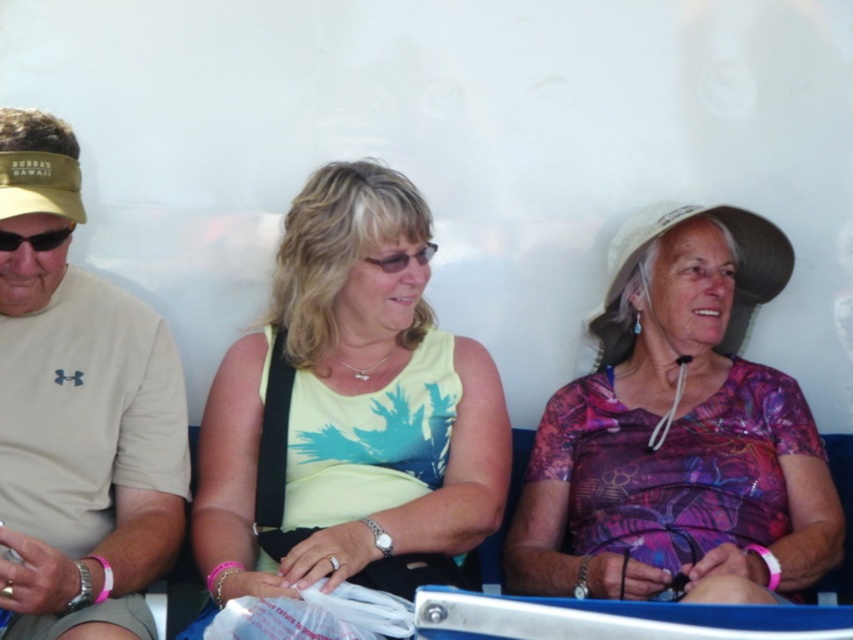
You are standing at the entrance of the fair and want to take a photo of both the purple printed dress at center and the black plastic sunglasses at left. Given that your camera can focus on objects within a 5 feet range, will you be able to capture both in one shot?

The distance between the purple printed dress at center and the black plastic sunglasses at left is 4.28 feet, which is within the 5 feet range of the camera. Therefore, you can capture both in one shot.

You are a fashion designer observing the attendees at a festival. You notice the yellow fabric tank top at center and the matte black glasses at center. Which of these two items appears bigger in size?

The yellow fabric tank top at center has a larger size compared to the matte black glasses at center, so the yellow fabric tank top at center appears bigger in size.